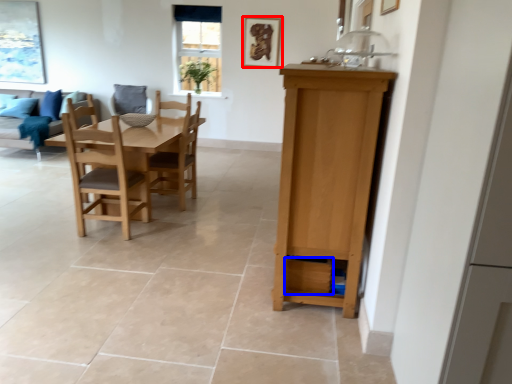
Question: Which object is further to the camera taking this photo, picture frame (highlighted by a red box) or drawer (highlighted by a blue box)?

Choices:
 (A) picture frame
 (B) drawer

Answer: (A)